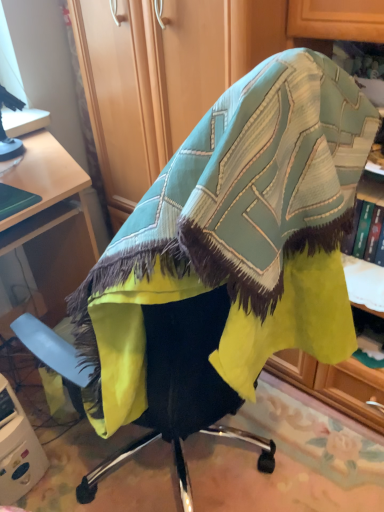
Where is `velvet yellow chair at center`? The height and width of the screenshot is (512, 384). velvet yellow chair at center is located at coordinates (183, 388).

The height and width of the screenshot is (512, 384). Describe the element at coordinates (183, 388) in the screenshot. I see `velvet yellow chair at center` at that location.

Locate an element on the screen. This screenshot has height=512, width=384. velvet yellow chair at center is located at coordinates (183, 388).